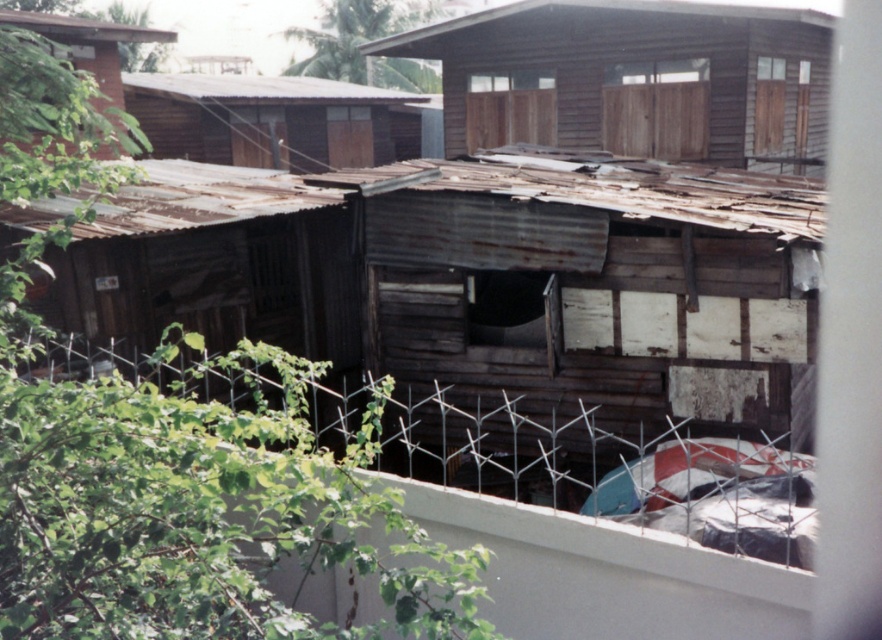
Question: Among these objects, which one is farthest from the camera?

Choices:
 (A) rusty corrugated metal hut at upper left
 (B) rusty corrugated metal hut at left
 (C) wooden hut at upper center
 (D) brown corrugated metal hut at upper left

Answer: (D)

Question: In this image, where is rusty corrugated metal hut at center located relative to rusty corrugated metal hut at left?

Choices:
 (A) left
 (B) right

Answer: (B)

Question: Which point is closer to the camera taking this photo?

Choices:
 (A) (122, 84)
 (B) (238, 387)
 (C) (66, 317)

Answer: (C)

Question: Does wooden hut at upper center appear under brown corrugated metal hut at upper left?

Choices:
 (A) yes
 (B) no

Answer: (A)

Question: Based on their relative distances, which object is farther from the wooden hut at upper center?

Choices:
 (A) rusty corrugated metal hut at upper left
 (B) rusty corrugated metal hut at left

Answer: (B)

Question: Does rusty corrugated metal hut at left have a smaller size compared to rusty corrugated metal hut at upper left?

Choices:
 (A) no
 (B) yes

Answer: (B)